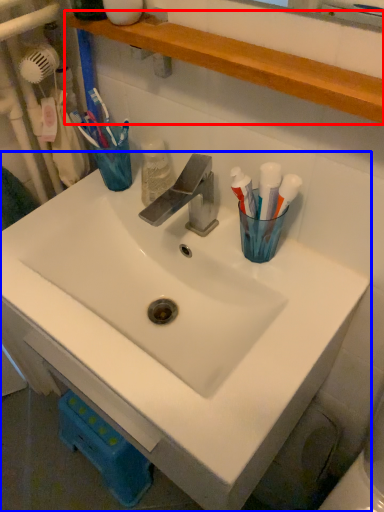
Question: Which object is closer to the camera taking this photo, shelve (highlighted by a red box) or sink (highlighted by a blue box)?

Choices:
 (A) shelve
 (B) sink

Answer: (A)